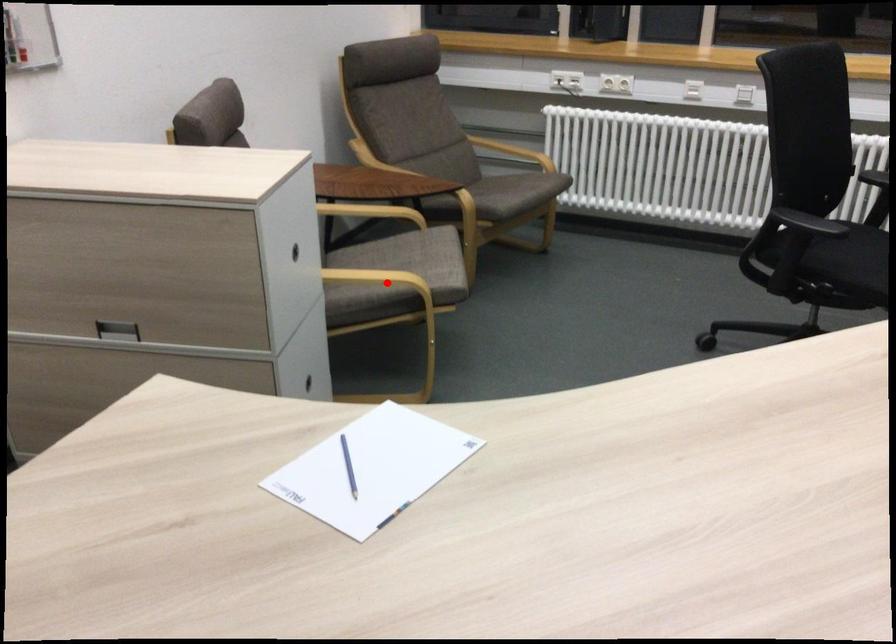
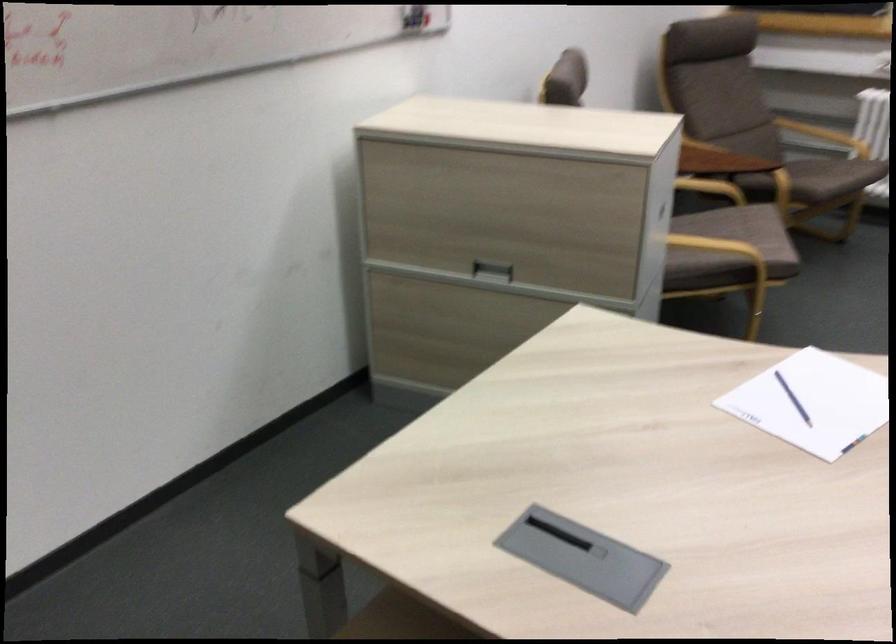
Find the pixel in the second image that matches the highlighted location in the first image.

(721, 249)